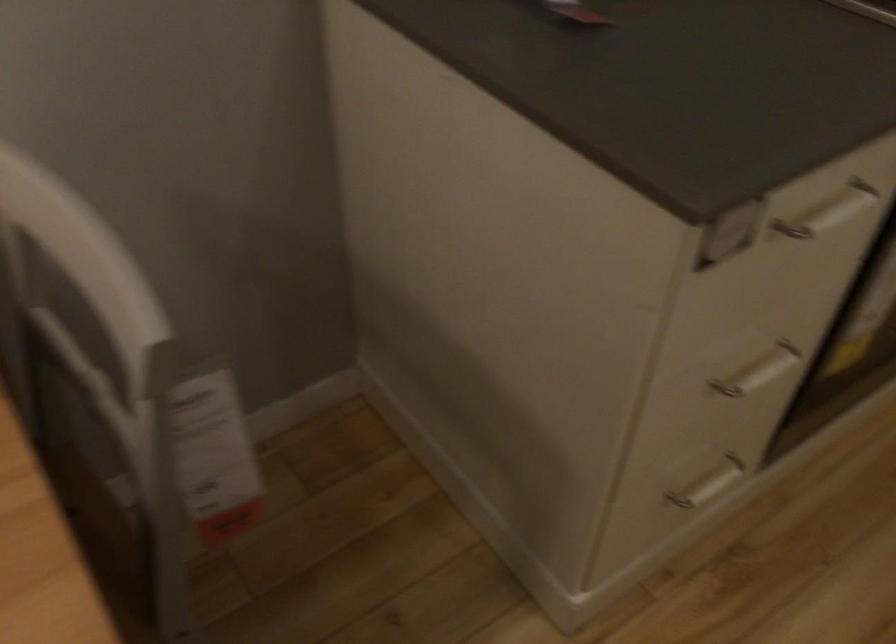
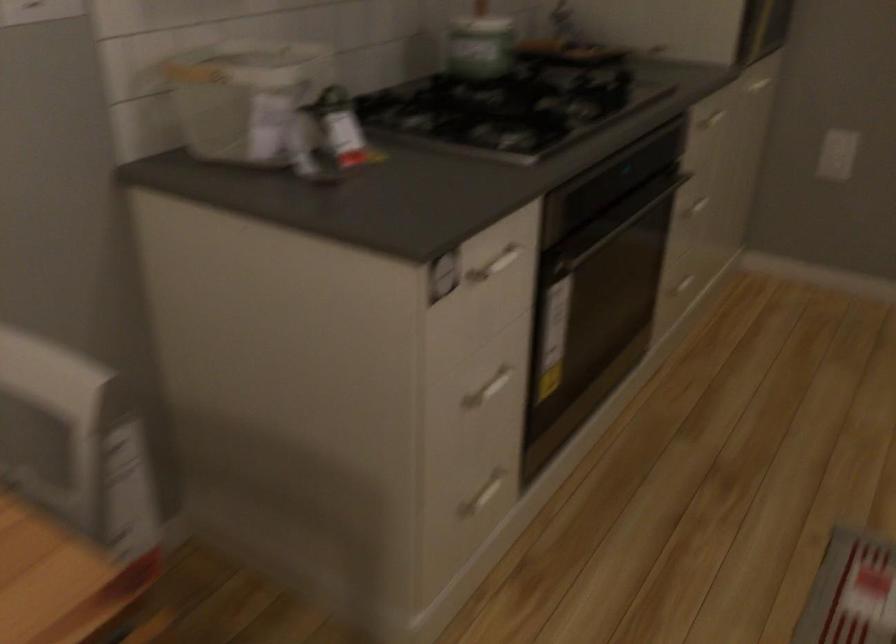
Find the pixel in the second image that matches point (702, 482) in the first image.

(484, 494)